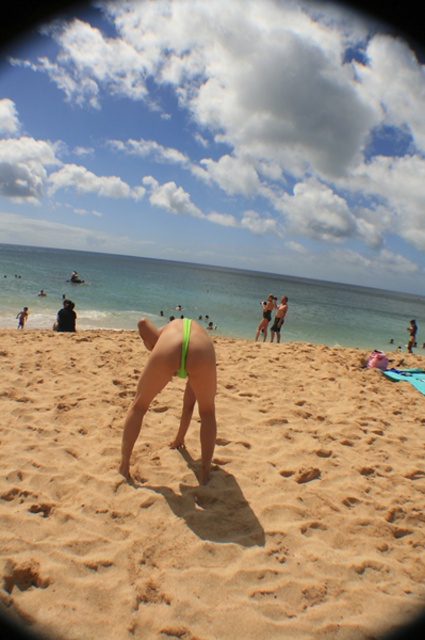
You are a photographer trying to capture the shadow of the person in the green fabric bikini bottom at center. Since the light brown sandy beach at center is below the bikini bottom, where should you position yourself to ensure the shadow is clearly visible on the beach?

The light brown sandy beach at center is below the green fabric bikini bottom at center, so positioning yourself between the bikini bottom and the beach will allow you to clearly see the shadow cast on the beach.

You are a photographer trying to capture the perfect shot of the beach scene. You notice the green fabric bikini bottom at center and the matte white bikini top at center. Which of these two items appears taller in the image?

Answer: The green fabric bikini bottom at center appears much taller than the matte white bikini top at center in the image.